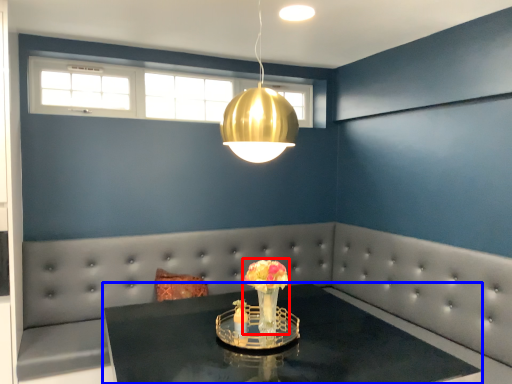
Question: Which object appears closest to the camera in this image, floral arrangement (highlighted by a red box) or table (highlighted by a blue box)?

Choices:
 (A) floral arrangement
 (B) table

Answer: (B)